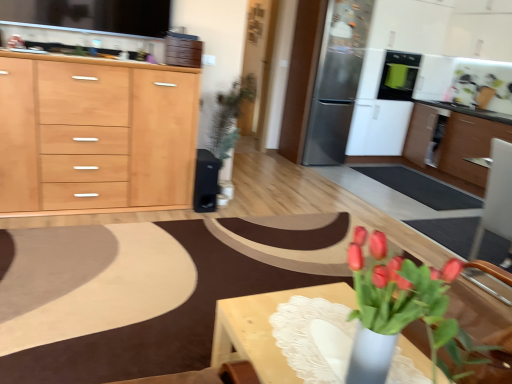
Question: Does stainless steel refrigerator at upper right have a lesser width compared to wooden table at lower right?

Choices:
 (A) no
 (B) yes

Answer: (A)

Question: Is stainless steel refrigerator at upper right facing away from wooden table at lower right?

Choices:
 (A) yes
 (B) no

Answer: (B)

Question: Is stainless steel refrigerator at upper right bigger than wooden table at lower right?

Choices:
 (A) no
 (B) yes

Answer: (B)

Question: Is stainless steel refrigerator at upper right behind wooden table at lower right?

Choices:
 (A) yes
 (B) no

Answer: (A)

Question: Is stainless steel refrigerator at upper right outside wooden table at lower right?

Choices:
 (A) no
 (B) yes

Answer: (B)

Question: Based on their sizes in the image, would you say wooden cabinet at right, positioned as the first cabinetry in back-to-front order, is bigger or smaller than black matte speaker at center, the third appliance positioned from the right?

Choices:
 (A) big
 (B) small

Answer: (A)

Question: Considering their positions, is wooden cabinet at right, the 1th cabinetry from the right, located in front of or behind black matte speaker at center, the third appliance positioned from the right?

Choices:
 (A) front
 (B) behind

Answer: (B)

Question: Considering the positions of wooden cabinet at right, which ranks as the second cabinetry in front-to-back order, and black matte speaker at center, which ranks as the 3th appliance in back-to-front order, in the image, is wooden cabinet at right, which ranks as the second cabinetry in front-to-back order, taller or shorter than black matte speaker at center, which ranks as the 3th appliance in back-to-front order,?

Choices:
 (A) short
 (B) tall

Answer: (B)

Question: From the image's perspective, is wooden cabinet at right, the 1th cabinetry from the right, positioned above or below black matte speaker at center, the 1th appliance when ordered from left to right?

Choices:
 (A) above
 (B) below

Answer: (A)

Question: Considering their positions, is wooden countertop at upper center located in front of or behind wooden cabinet at right, which ranks as the second cabinetry in front-to-back order?

Choices:
 (A) behind
 (B) front

Answer: (B)

Question: Is wooden countertop at upper center inside the boundaries of wooden cabinet at right, placed as the 2th cabinetry when sorted from left to right, or outside?

Choices:
 (A) inside
 (B) outside

Answer: (B)

Question: Looking at their shapes, would you say wooden countertop at upper center is wider or thinner than wooden cabinet at right, which ranks as the second cabinetry in front-to-back order?

Choices:
 (A) wide
 (B) thin

Answer: (B)

Question: Is point (95, 56) closer or farther from the camera than point (411, 120)?

Choices:
 (A) farther
 (B) closer

Answer: (B)

Question: Is light wood/texture cabinet at left, which is counted as the 1th cabinetry, starting from the front, taller or shorter than wooden countertop at upper center?

Choices:
 (A) tall
 (B) short

Answer: (A)

Question: Would you say light wood/texture cabinet at left, the second cabinetry when ordered from right to left, is inside or outside wooden countertop at upper center?

Choices:
 (A) inside
 (B) outside

Answer: (B)